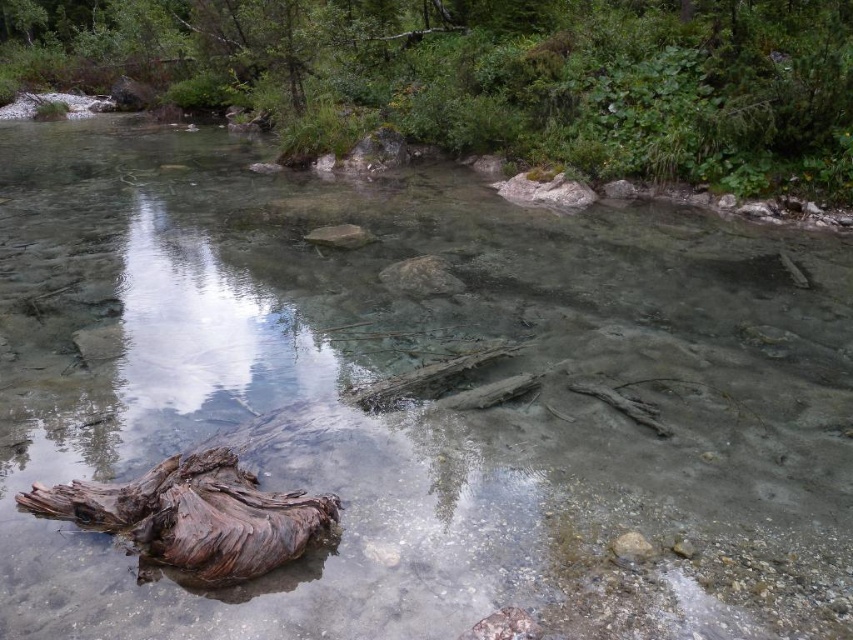
Between brown wood log at upper center and brown rough log at lower left, which one has more height?

With more height is brown wood log at upper center.

From the picture: Who is more distant from viewer, (x=49, y=33) or (x=248, y=483)?

Positioned behind is point (x=49, y=33).

Locate an element on the screen. brown wood log at upper center is located at coordinates (486, 76).